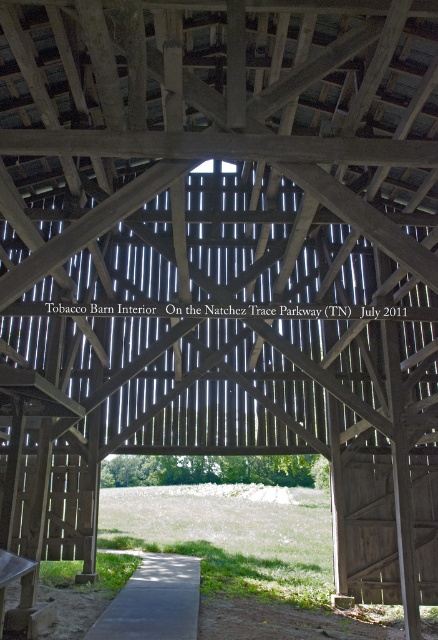
Is gray concrete path at center positioned in front of wooden picnic table at lower left?

That is False.

Does gray concrete path at center appear on the right side of wooden picnic table at lower left?

Yes, gray concrete path at center is to the right of wooden picnic table at lower left.

Identify the location of gray concrete path at center. (152, 600).

Where is `gray concrete path at center`? gray concrete path at center is located at coordinates (152, 600).